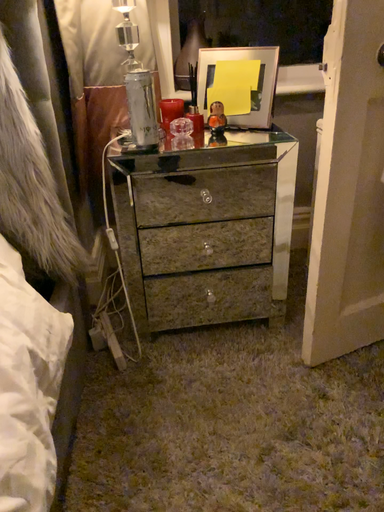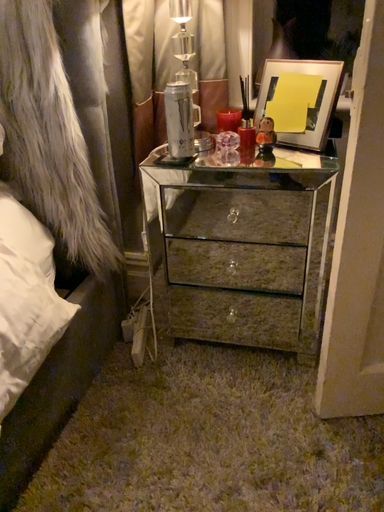
Question: Which way did the camera rotate in the video?

Choices:
 (A) rotated right
 (B) rotated left

Answer: (B)